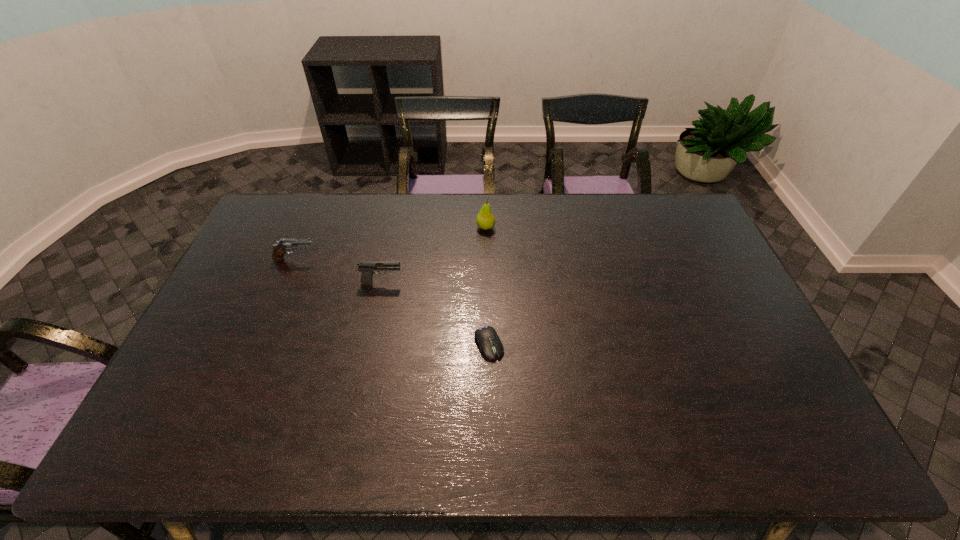
Where is `free location that satisfies the following two spatial constraints: 1. aim along the barrel of the third farthest object; 2. on the back side of the computer equipment`? Image resolution: width=960 pixels, height=540 pixels. free location that satisfies the following two spatial constraints: 1. aim along the barrel of the third farthest object; 2. on the back side of the computer equipment is located at coordinates (370, 344).

You are a GUI agent. You are given a task and a screenshot of the screen. Output one action in this format:
    pyautogui.click(x=<x>, y=<y>)
    Task: Click on the free space that satisfies the following two spatial constraints: 1. on the back side of the nearest object; 2. aim along the barrel of the second object from left to right
    The height and width of the screenshot is (540, 960).
    Given the screenshot: What is the action you would take?
    (488, 282)

Locate an element on the screen. free space that satisfies the following two spatial constraints: 1. at the barrel of the computer equipment; 2. on the right side of the farther pistol is located at coordinates (260, 344).

You are a GUI agent. You are given a task and a screenshot of the screen. Output one action in this format:
    pyautogui.click(x=<x>, y=<y>)
    Task: Click on the vacant space that satisfies the following two spatial constraints: 1. aim along the barrel of the right pistol; 2. on the back side of the shortest object
    
    Given the screenshot: What is the action you would take?
    pyautogui.click(x=370, y=344)

At what (x,y) coordinates should I click in order to perform the action: click on vacant space that satisfies the following two spatial constraints: 1. on the front side of the nearest object; 2. on the left side of the tallest object. Please return your answer as a coordinate pair (x, y). The image size is (960, 540). Looking at the image, I should click on (488, 344).